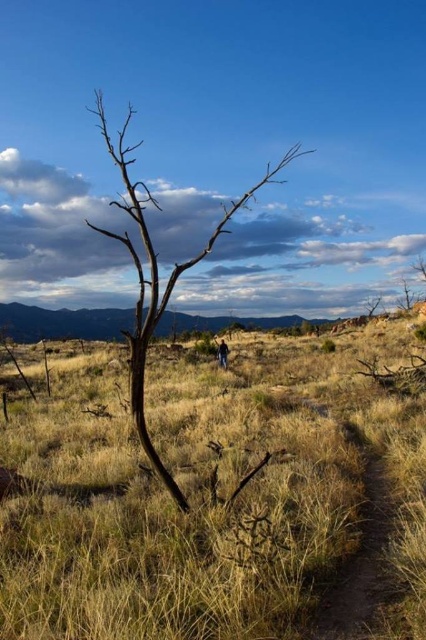
Looking at this image, you are a hiker standing in the middle of the field. You see the brown dry grass at center and the brown matte tree at center. Which object is positioned to the right side from your perspective?

The brown dry grass at center is to the right of the brown matte tree at center, so the brown dry grass at center is positioned to the right side from your perspective.

You are a hiker planning to walk along the brown dirt path at lower right. You want to know if the brown matte tree at center is wider than the path. Can you determine this from the image?

The brown matte tree at center might be wider than brown dirt path at lower right according to the description.